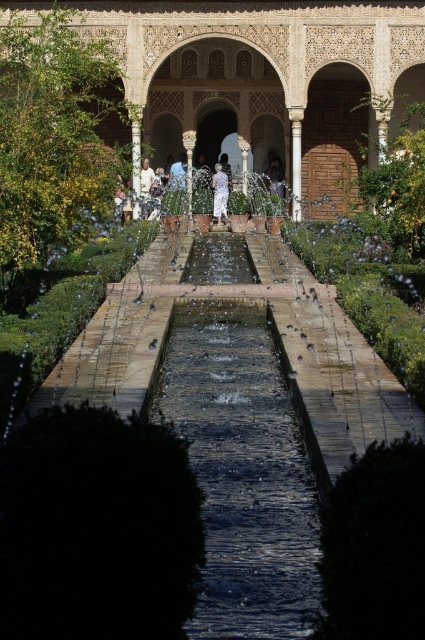
Can you confirm if white marble pillar at center is bigger than white cotton dress at center?

Yes, white marble pillar at center is bigger than white cotton dress at center.

Identify the location of white marble pillar at center. Image resolution: width=425 pixels, height=640 pixels. (295, 161).

Between clear water at center and light beige fabric dress at center, which one appears on the left side from the viewer's perspective?

Positioned to the left is clear water at center.

Which is in front, point (180, 332) or point (271, 182)?

Positioned in front is point (180, 332).

The width and height of the screenshot is (425, 640). I want to click on clear water at center, so click(243, 472).

Is matte white palace at center to the right of matte stone pillar at center from the viewer's perspective?

Yes, matte white palace at center is to the right of matte stone pillar at center.

Which of these two, matte white palace at center or matte stone pillar at center, stands taller?

Standing taller between the two is matte white palace at center.

This screenshot has width=425, height=640. What do you see at coordinates (268, 77) in the screenshot?
I see `matte white palace at center` at bounding box center [268, 77].

At what (x,y) coordinates should I click in order to perform the action: click on matte white palace at center. Please return your answer as a coordinate pair (x, y). The height and width of the screenshot is (640, 425). Looking at the image, I should click on (268, 77).